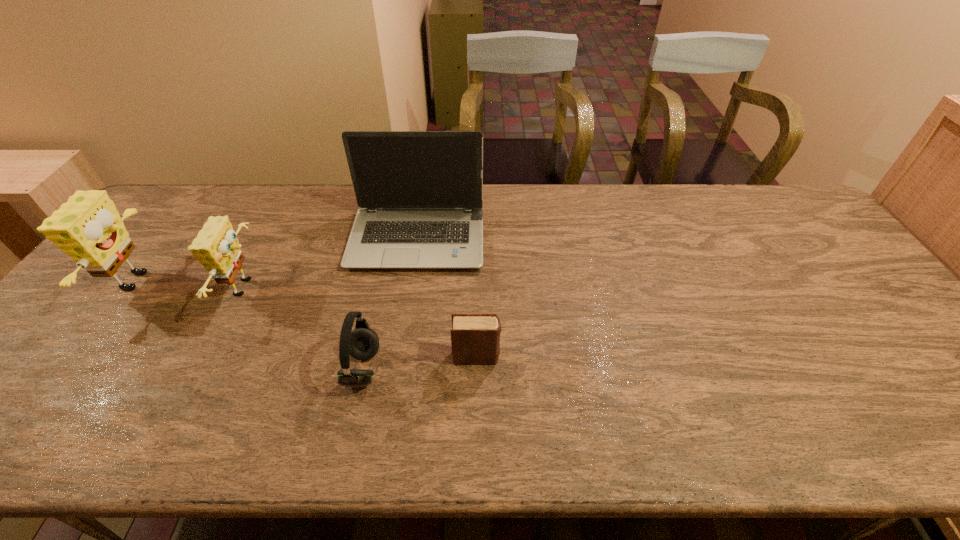
You are a GUI agent. You are given a task and a screenshot of the screen. Output one action in this format:
    pyautogui.click(x=<x>, y=<y>)
    Task: Click on the free area in between the second object from left to right and the taller sponge
    The width and height of the screenshot is (960, 540).
    Given the screenshot: What is the action you would take?
    pyautogui.click(x=192, y=284)

Where is `free space between the laptop computer and the second object from left to right`? The image size is (960, 540). free space between the laptop computer and the second object from left to right is located at coordinates (332, 264).

Locate an element on the screen. unoccupied position between the left sponge and the laptop computer is located at coordinates (277, 261).

Locate an element on the screen. empty space between the diary and the taller sponge is located at coordinates (307, 319).

Locate an element on the screen. The width and height of the screenshot is (960, 540). unoccupied position between the laptop computer and the fourth tallest object is located at coordinates (390, 305).

Locate an element on the screen. This screenshot has height=540, width=960. free point between the left sponge and the diary is located at coordinates (307, 319).

The image size is (960, 540). Identify the location of unoccupied area between the second object from left to right and the laptop computer. (332, 264).

Select which object is the second closest to the right sponge. Please provide its 2D coordinates. Your answer should be formatted as a tuple, i.e. [(x, y)], where the tuple contains the x and y coordinates of a point satisfying the conditions above.

[(88, 228)]

This screenshot has height=540, width=960. What are the coordinates of `object that is the closest one to the right sponge` in the screenshot? It's located at (420, 193).

Identify the location of free region that satisfies the following two spatial constraints: 1. on the screen of the laptop computer; 2. on the front-facing side of the taller sponge. The height and width of the screenshot is (540, 960). (411, 281).